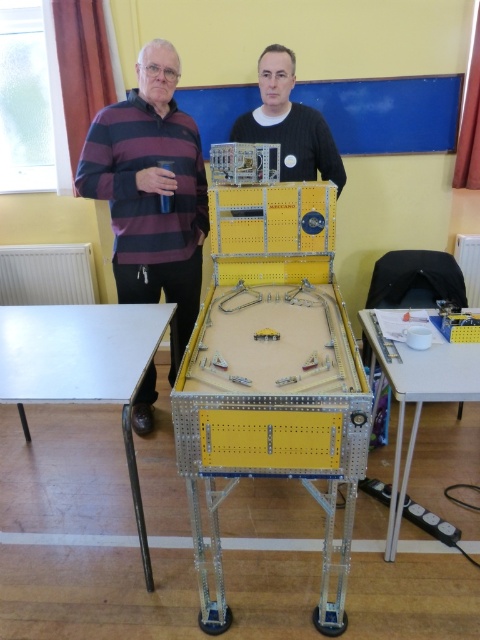
You are standing in front of the pinball machine and want to place a sticker on the point that is closer to you. Which point should you choose between point [98,376] and point [285,60]?

Point [98,376] is closer to the camera than point [285,60], so you should choose point [98,376] to place the sticker.

You are a visitor in the room and want to know if the metallic yellow pinball machine at center can fit through a doorway that is the same height as the striped cotton sweater at upper left. Can it?

The metallic yellow pinball machine at center is not as tall as the striped cotton sweater at upper left, so it can fit through the doorway that matches the sweater height.

You are standing in front of the pinball machine and want to place a sticker on the point closer to you. Which point should you choose between point (123, 211) and point (139, 490)?

Point (123, 211) is closer to you, so you should choose that point to place the sticker.